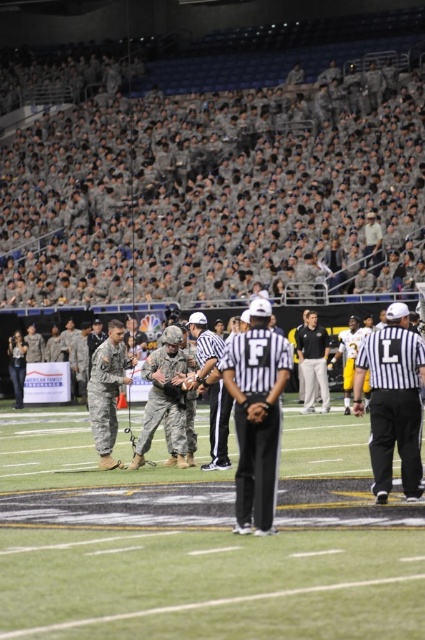
Question: Which of these objects is positioned closest to the black smooth shirt at center?

Choices:
 (A) camouflage fabric uniform at center
 (B) green turf at center
 (C) black striped shirt at center
 (D) black striped referee uniform at center

Answer: (B)

Question: Does green turf at center appear under camouflage fabric uniform at center?

Choices:
 (A) yes
 (B) no

Answer: (A)

Question: Can you confirm if green turf at center is smaller than camouflage fabric uniform at center?

Choices:
 (A) no
 (B) yes

Answer: (A)

Question: Which point appears closest to the camera in this image?

Choices:
 (A) (107, 324)
 (B) (246, 380)
 (C) (374, 333)
 (D) (328, 348)

Answer: (B)

Question: Which of the following is the closest to the observer?

Choices:
 (A) green turf at center
 (B) black striped referee uniform at center
 (C) camouflage fabric uniform at center

Answer: (A)

Question: Is green turf at center below camouflage fabric uniform at center?

Choices:
 (A) no
 (B) yes

Answer: (B)